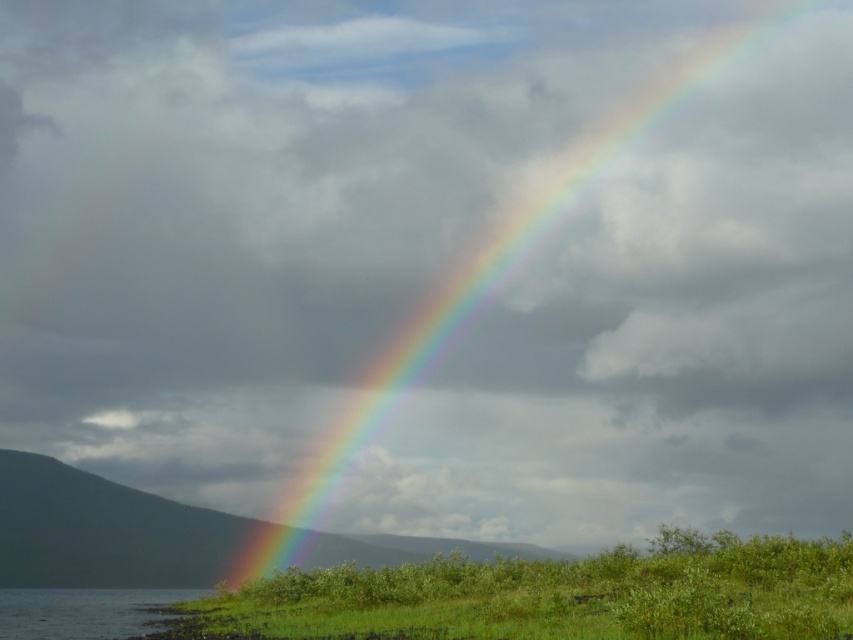
Question: Which point appears closest to the camera in this image?

Choices:
 (A) (151, 612)
 (B) (668, 625)
 (C) (560, 180)

Answer: (B)

Question: Which object appears farthest from the camera in this image?

Choices:
 (A) green leafy shrubs at lower center
 (B) rainbow at upper center

Answer: (B)

Question: Which object is positioned farthest from the green leafy shrubs at lower center?

Choices:
 (A) clear water at lower left
 (B) rainbow at upper center

Answer: (B)

Question: Can you confirm if green leafy shrubs at lower center is wider than clear water at lower left?

Choices:
 (A) yes
 (B) no

Answer: (A)

Question: Can you confirm if green leafy shrubs at lower center is positioned below clear water at lower left?

Choices:
 (A) no
 (B) yes

Answer: (A)

Question: Observing the image, what is the correct spatial positioning of green leafy shrubs at lower center in reference to clear water at lower left?

Choices:
 (A) below
 (B) above

Answer: (B)